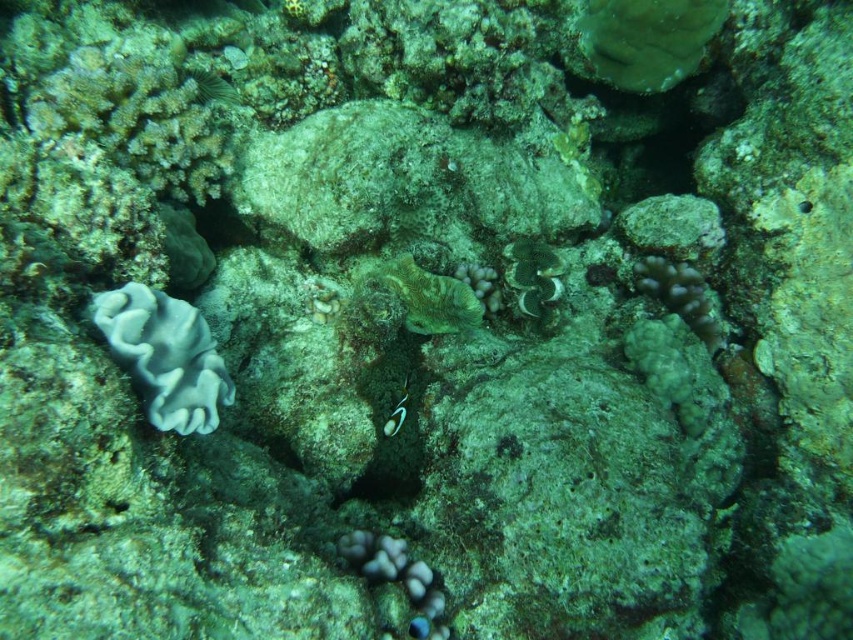
Between white coral at left and green iridescent fish at center, which one has more height?

white coral at left is taller.

Which is more to the right, white coral at left or green iridescent fish at center?

From the viewer's perspective, green iridescent fish at center appears more on the right side.

The width and height of the screenshot is (853, 640). What do you see at coordinates (165, 355) in the screenshot? I see `white coral at left` at bounding box center [165, 355].

Find the location of `white coral at left`. white coral at left is located at coordinates (165, 355).

Can you confirm if white coral at left is wider than green coral at center?

Correct, the width of white coral at left exceeds that of green coral at center.

Between point (219, 403) and point (558, 273), which one is positioned behind?

Point (558, 273)

Where is `white coral at left`? The image size is (853, 640). white coral at left is located at coordinates [x=165, y=355].

You are a GUI agent. You are given a task and a screenshot of the screen. Output one action in this format:
    pyautogui.click(x=<x>, y=<y>)
    Task: Click on the white coral at left
    The height and width of the screenshot is (640, 853).
    Given the screenshot: What is the action you would take?
    pyautogui.click(x=165, y=355)

Who is taller, smooth coral at center or ruffled coral at center?

With more height is ruffled coral at center.

Measure the distance between smooth coral at center and ruffled coral at center.

They are 27.78 inches apart.

Measure the distance between smooth coral at center and camera.

smooth coral at center is 1.13 meters from camera.

Locate an element on the screen. smooth coral at center is located at coordinates (398, 577).